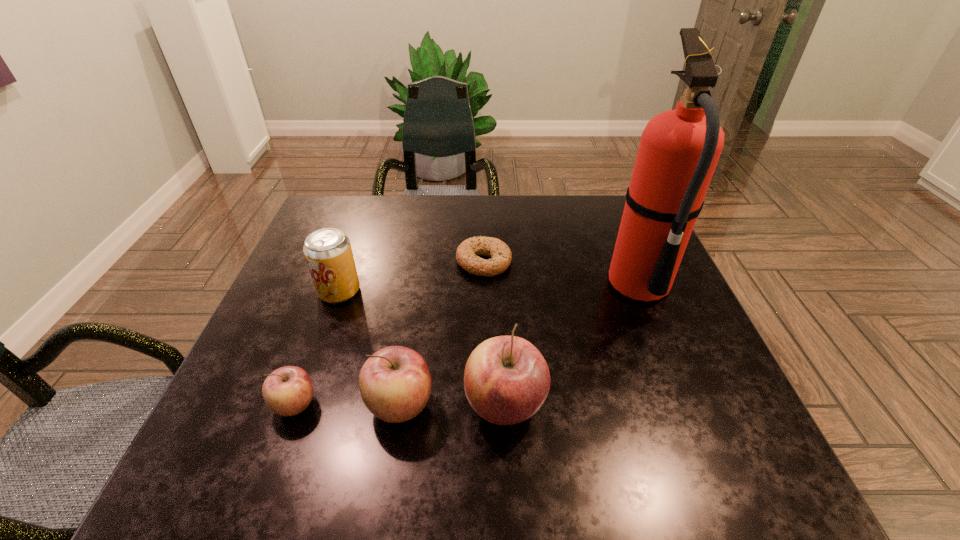
Identify the location of free space between the rightmost apple and the bagel. (494, 334).

You are a GUI agent. You are given a task and a screenshot of the screen. Output one action in this format:
    pyautogui.click(x=<x>, y=<y>)
    Task: Click on the free space between the tallest object and the pop (soda)
    This screenshot has height=540, width=960.
    Given the screenshot: What is the action you would take?
    pyautogui.click(x=490, y=288)

At what (x,y) coordinates should I click in order to perform the action: click on unoccupied position between the rightmost apple and the pop (soda). Please return your answer as a coordinate pair (x, y). Looking at the image, I should click on (422, 348).

You are a GUI agent. You are given a task and a screenshot of the screen. Output one action in this format:
    pyautogui.click(x=<x>, y=<y>)
    Task: Click on the blank region between the shortest object and the shortest apple
    
    Given the screenshot: What is the action you would take?
    pyautogui.click(x=390, y=333)

The height and width of the screenshot is (540, 960). In order to click on free spot between the rightmost apple and the rightmost object in this screenshot , I will do `click(572, 345)`.

Identify which object is the third nearest to the second apple from left to right. Please provide its 2D coordinates. Your answer should be formatted as a tuple, i.e. [(x, y)], where the tuple contains the x and y coordinates of a point satisfying the conditions above.

[(328, 253)]

You are a GUI agent. You are given a task and a screenshot of the screen. Output one action in this format:
    pyautogui.click(x=<x>, y=<y>)
    Task: Click on the object that stands as the second closest to the rightmost apple
    Image resolution: width=960 pixels, height=540 pixels.
    Given the screenshot: What is the action you would take?
    pyautogui.click(x=679, y=149)

At what (x,y) coordinates should I click in order to perform the action: click on the second closest apple to the shortest apple. Please return your answer as a coordinate pair (x, y). The width and height of the screenshot is (960, 540). Looking at the image, I should click on (506, 380).

Choose which apple is the second nearest neighbor to the fourth object from right to left. Please provide its 2D coordinates. Your answer should be formatted as a tuple, i.e. [(x, y)], where the tuple contains the x and y coordinates of a point satisfying the conditions above.

[(287, 391)]

This screenshot has height=540, width=960. I want to click on vacant space that satisfies the following two spatial constraints: 1. at the nozzle of the tallest object; 2. on the front side of the rightmost apple, so click(687, 405).